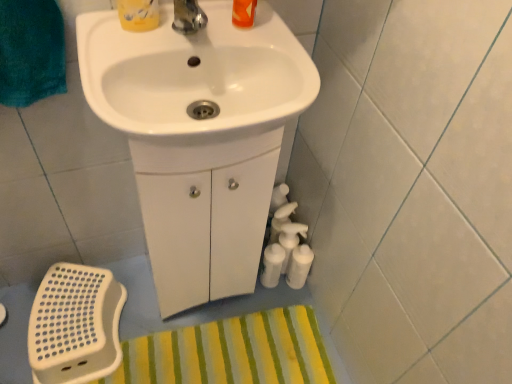
Question: Can white glossy sink at upper center, marked as the 2th sink in a back-to-front arrangement, be found inside white glossy sink at center, the second sink when ordered from front to back?

Choices:
 (A) yes
 (B) no

Answer: (B)

Question: Does white glossy sink at center, the second sink when ordered from front to back, appear on the left side of white glossy sink at upper center, marked as the 2th sink in a back-to-front arrangement?

Choices:
 (A) yes
 (B) no

Answer: (A)

Question: Is white glossy sink at center, the second sink when ordered from front to back, positioned far away from white glossy sink at upper center, marked as the 2th sink in a back-to-front arrangement?

Choices:
 (A) no
 (B) yes

Answer: (A)

Question: Considering the relative positions of white glossy sink at center, the second sink when ordered from front to back, and white glossy sink at upper center, which ranks as the 1th sink in front-to-back order, in the image provided, is white glossy sink at center, the second sink when ordered from front to back, behind white glossy sink at upper center, which ranks as the 1th sink in front-to-back order,?

Choices:
 (A) no
 (B) yes

Answer: (B)

Question: Is white glossy sink at upper center, marked as the 2th sink in a back-to-front arrangement, at the back of white glossy sink at center, the second sink when ordered from front to back?

Choices:
 (A) no
 (B) yes

Answer: (A)

Question: Considering their positions, is yellow striped bath mat at lower center located in front of or behind white glossy sink at upper center, marked as the 2th sink in a back-to-front arrangement?

Choices:
 (A) behind
 (B) front

Answer: (A)

Question: Is yellow striped bath mat at lower center wider or thinner than white glossy sink at upper center, marked as the 2th sink in a back-to-front arrangement?

Choices:
 (A) thin
 (B) wide

Answer: (B)

Question: From their relative heights in the image, would you say yellow striped bath mat at lower center is taller or shorter than white glossy sink at upper center, marked as the 2th sink in a back-to-front arrangement?

Choices:
 (A) short
 (B) tall

Answer: (A)

Question: Is yellow striped bath mat at lower center bigger or smaller than white glossy sink at upper center, marked as the 2th sink in a back-to-front arrangement?

Choices:
 (A) small
 (B) big

Answer: (A)

Question: From the image's perspective, is white glossy sink at center, the first sink from the back, located above or below white glossy sink at upper center, which ranks as the 1th sink in front-to-back order?

Choices:
 (A) above
 (B) below

Answer: (B)

Question: In terms of width, does white glossy sink at center, the first sink from the back, look wider or thinner when compared to white glossy sink at upper center, which ranks as the 1th sink in front-to-back order?

Choices:
 (A) wide
 (B) thin

Answer: (B)

Question: Is white glossy sink at center, the second sink when ordered from front to back, bigger or smaller than white glossy sink at upper center, which ranks as the 1th sink in front-to-back order?

Choices:
 (A) small
 (B) big

Answer: (B)

Question: Is white glossy sink at center, the first sink from the back, to the left or to the right of white glossy sink at upper center, marked as the 2th sink in a back-to-front arrangement, in the image?

Choices:
 (A) left
 (B) right

Answer: (A)

Question: In terms of height, does white glossy sink at center, the first sink from the back, look taller or shorter compared to yellow striped bath mat at lower center?

Choices:
 (A) short
 (B) tall

Answer: (B)

Question: In the image, is white glossy sink at center, the second sink when ordered from front to back, positioned in front of or behind yellow striped bath mat at lower center?

Choices:
 (A) front
 (B) behind

Answer: (A)